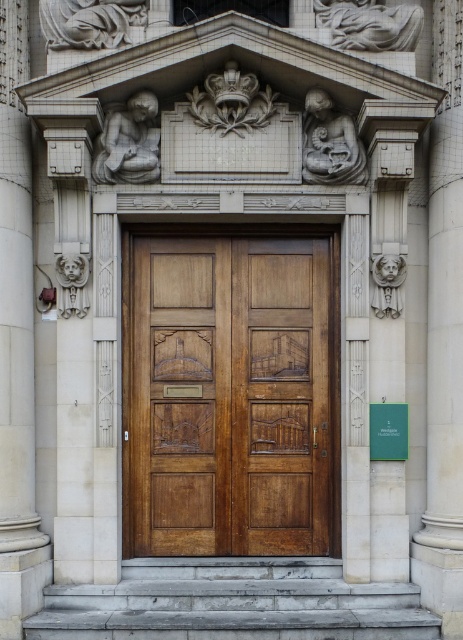
You are an architect designing a new building and want to ensure that the entrance area has enough space for visitors to gather. Given the wooden carved door at center and the gray stone stairs at lower center, which object takes up more space in the entrance area?

The gray stone stairs at lower center occupy more space than the wooden carved door at center, so they take up more space in the entrance area.

You are an architect designing a new building entrance. You need to install a security camera that can cover both the polished wood door at center and the wooden carved door at center. Given their sizes, which door should the camera be positioned closer to for optimal coverage?

The polished wood door at center is larger in size than the wooden carved door at center, so the camera should be positioned closer to the wooden carved door at center to ensure both doors are fully within the camera view.

You are standing in front of the grand entrance and want to walk towards the building. Which of the two points, point (126, 369) or point (202, 636), will you encounter first?

Point (202, 636) will be encountered first because it is in front of point (126, 369).